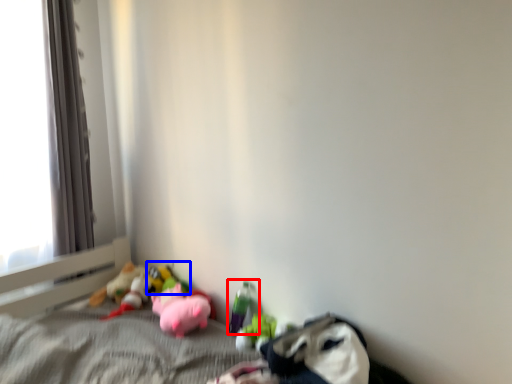
Question: Among these objects, which one is farthest to the camera, toy (highlighted by a red box) or toy (highlighted by a blue box)?

Choices:
 (A) toy
 (B) toy

Answer: (B)